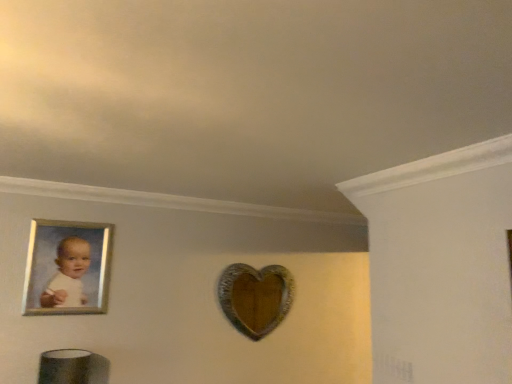
Image resolution: width=512 pixels, height=384 pixels. Describe the element at coordinates (67, 268) in the screenshot. I see `silver metallic picture frame at upper left` at that location.

The height and width of the screenshot is (384, 512). What are the coordinates of `silver metallic picture frame at upper left` in the screenshot? It's located at (67, 268).

What do you see at coordinates (255, 297) in the screenshot?
I see `wooden heart at center` at bounding box center [255, 297].

What are the coordinates of `wooden heart at center` in the screenshot? It's located at (255, 297).

Where is `silver metallic picture frame at upper left`? Image resolution: width=512 pixels, height=384 pixels. silver metallic picture frame at upper left is located at coordinates (67, 268).

Based on the photo, which is more to the right, silver metallic picture frame at upper left or wooden heart at center?

wooden heart at center is more to the right.

Consider the image. Considering the relative positions of silver metallic picture frame at upper left and wooden heart at center in the image provided, is silver metallic picture frame at upper left behind wooden heart at center?

No, silver metallic picture frame at upper left is closer to the camera.

Is point (92, 290) behind point (267, 316)?

No, (92, 290) is closer to viewer.

From the image's perspective, is silver metallic picture frame at upper left located beneath wooden heart at center?

Incorrect, from the image's perspective, silver metallic picture frame at upper left is higher than wooden heart at center.

From a real-world perspective, which is physically below, silver metallic picture frame at upper left or wooden heart at center?

wooden heart at center.

Considering the sizes of objects silver metallic picture frame at upper left and wooden heart at center in the image provided, who is wider, silver metallic picture frame at upper left or wooden heart at center?

Wider between the two is wooden heart at center.

Does silver metallic picture frame at upper left have a greater height compared to wooden heart at center?

In fact, silver metallic picture frame at upper left may be shorter than wooden heart at center.

Who is bigger, silver metallic picture frame at upper left or wooden heart at center?

wooden heart at center is bigger.

Which is correct: silver metallic picture frame at upper left is inside wooden heart at center, or outside of it?

silver metallic picture frame at upper left exists outside the volume of wooden heart at center.

Is silver metallic picture frame at upper left placed right next to wooden heart at center?

silver metallic picture frame at upper left and wooden heart at center are not in contact.

Is silver metallic picture frame at upper left facing towards wooden heart at center?

No, silver metallic picture frame at upper left is not oriented towards wooden heart at center.

The height and width of the screenshot is (384, 512). Identify the location of mirror below the silver metallic picture frame at upper left (from the image's perspective). (255, 297).

Based on the photo, is wooden heart at center at the left side of silver metallic picture frame at upper left?

In fact, wooden heart at center is to the right of silver metallic picture frame at upper left.

Is wooden heart at center positioned in front of silver metallic picture frame at upper left?

No, it is behind silver metallic picture frame at upper left.

Which is behind, point (234, 295) or point (42, 300)?

Point (234, 295)

From the image's perspective, between wooden heart at center and silver metallic picture frame at upper left, who is located below?

wooden heart at center, from the image's perspective.

From a real-world perspective, is wooden heart at center physically located above or below silver metallic picture frame at upper left?

wooden heart at center is below silver metallic picture frame at upper left.

Can you confirm if wooden heart at center is thinner than silver metallic picture frame at upper left?

In fact, wooden heart at center might be wider than silver metallic picture frame at upper left.

Which of these two, wooden heart at center or silver metallic picture frame at upper left, stands taller?

wooden heart at center is taller.

Which of these two, wooden heart at center or silver metallic picture frame at upper left, is bigger?

Bigger between the two is wooden heart at center.

Is wooden heart at center inside or outside of silver metallic picture frame at upper left?

wooden heart at center exists outside the volume of silver metallic picture frame at upper left.

Would you say wooden heart at center is a long distance from silver metallic picture frame at upper left?

Yes.

Does wooden heart at center turn towards silver metallic picture frame at upper left?

No, wooden heart at center does not turn towards silver metallic picture frame at upper left.

How many degrees apart are the facing directions of wooden heart at center and silver metallic picture frame at upper left?

The facing directions of wooden heart at center and silver metallic picture frame at upper left are 2.13 degrees apart.

The height and width of the screenshot is (384, 512). Identify the location of picture frame that is above the wooden heart at center (from a real-world perspective). (67, 268).

Find the location of a particular element. This screenshot has width=512, height=384. picture frame that is in front of the wooden heart at center is located at coordinates (67, 268).

Identify the location of picture frame above the wooden heart at center (from the image's perspective). (67, 268).